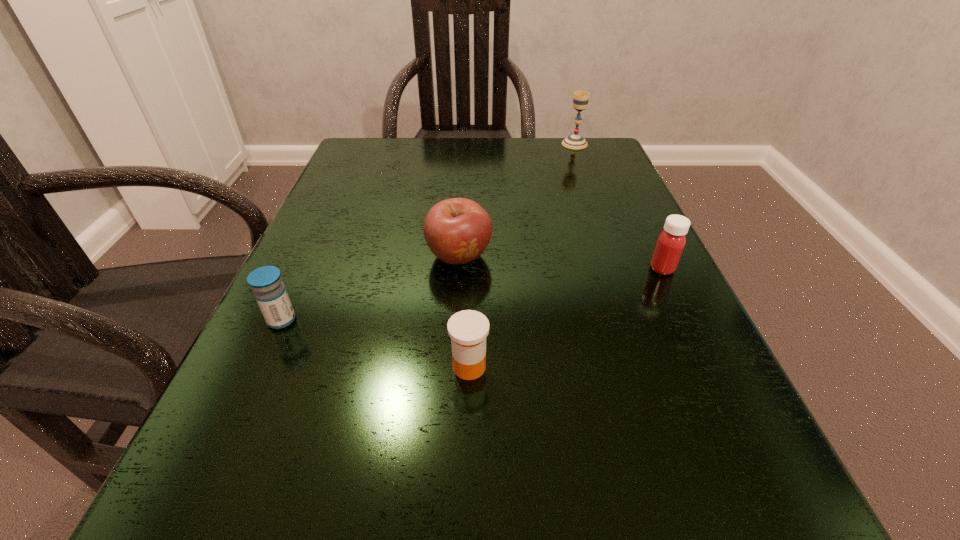
Where is `free location that satisfies the following two spatial constraints: 1. on the front side of the rightmost medicine; 2. on the label of the nearest object`? The image size is (960, 540). free location that satisfies the following two spatial constraints: 1. on the front side of the rightmost medicine; 2. on the label of the nearest object is located at coordinates (709, 367).